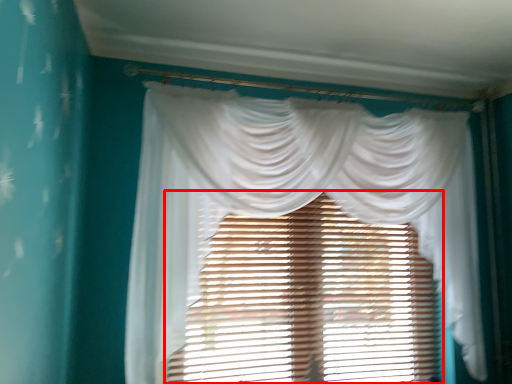
Question: From the image's perspective, considering the relative positions of window blind (annotated by the red box) and curtain in the image provided, where is window blind (annotated by the red box) located with respect to the staircase?

Choices:
 (A) above
 (B) below

Answer: (B)